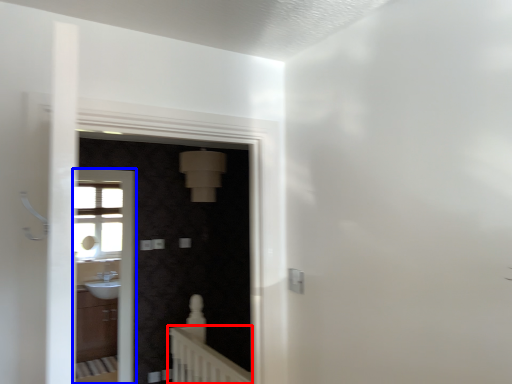
Question: Which object appears closest to the camera in this image, balustrade (highlighted by a red box) or screen door (highlighted by a blue box)?

Choices:
 (A) balustrade
 (B) screen door

Answer: (A)